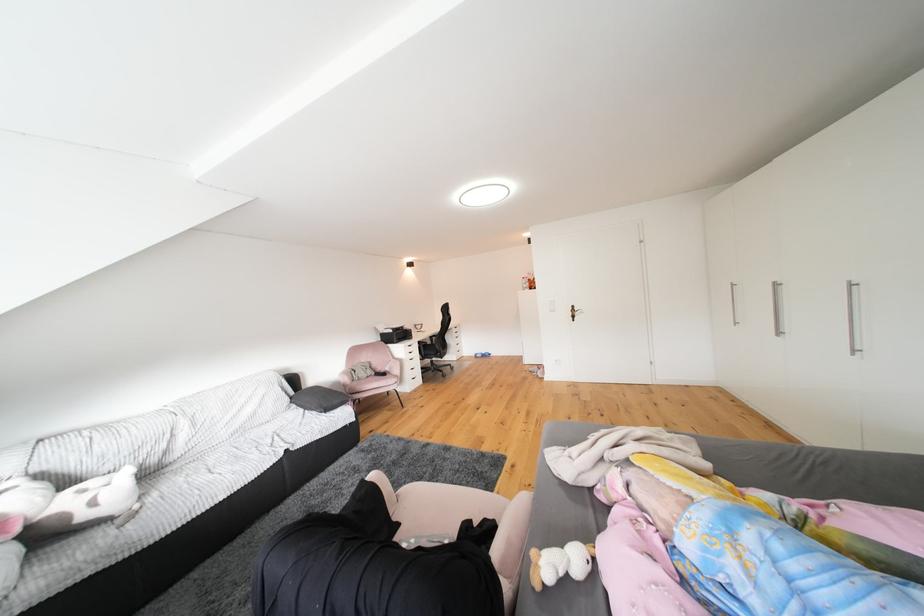
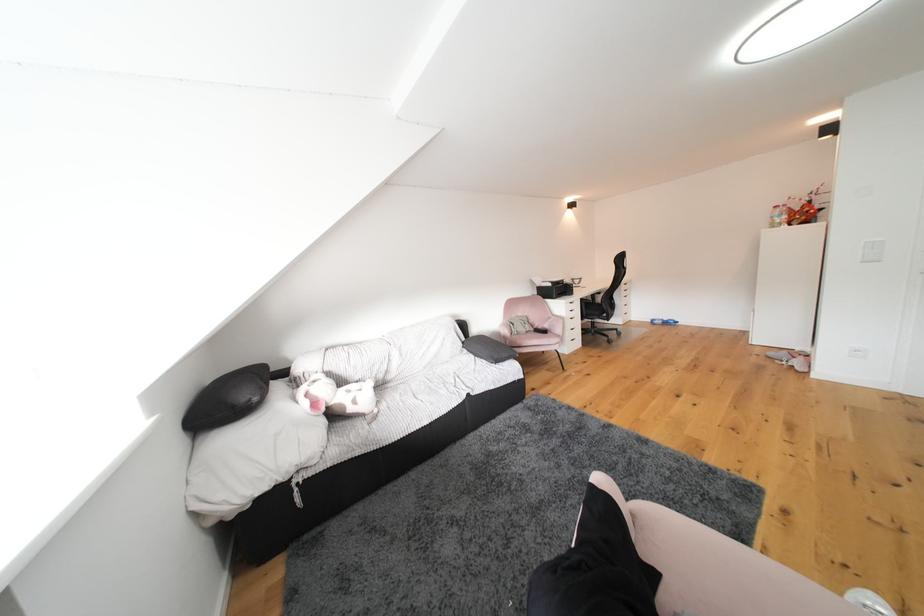
Where in the second image is the point corresponding to the point at 392,374 from the first image?

(550, 331)